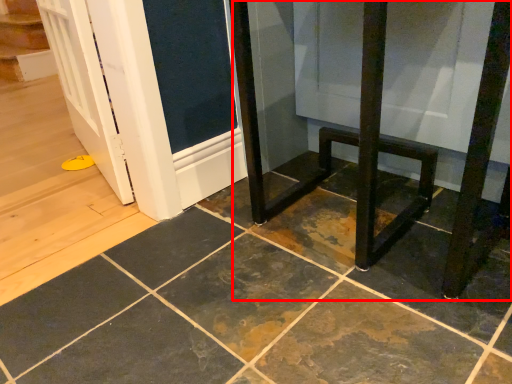
Question: From the image's perspective, where is furniture (annotated by the red box) located in relation to ceramic tile in the image?

Choices:
 (A) above
 (B) below

Answer: (A)